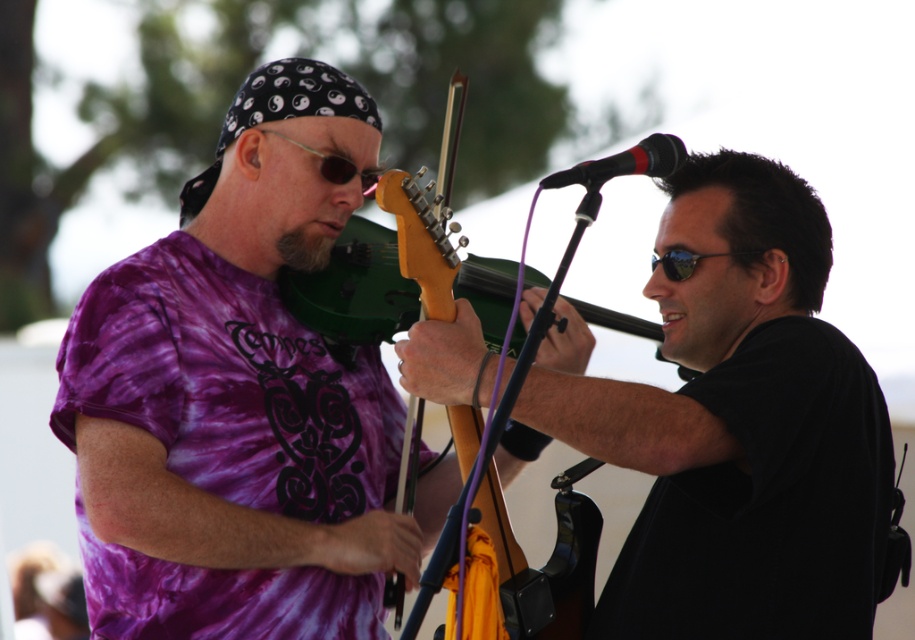
Question: Can you confirm if matte black guitar at center is positioned below green matte violin at center?

Choices:
 (A) no
 (B) yes

Answer: (B)

Question: Considering the relative positions of purple tie-dye shirt at center and matte black guitar at center in the image provided, where is purple tie-dye shirt at center located with respect to matte black guitar at center?

Choices:
 (A) left
 (B) right

Answer: (A)

Question: Which of the following is the closest to the observer?

Choices:
 (A) matte black guitar at center
 (B) green matte violin at center

Answer: (B)

Question: Can you confirm if purple tie-dye shirt at center is positioned to the right of green matte violin at center?

Choices:
 (A) no
 (B) yes

Answer: (A)

Question: Which point appears farthest from the camera in this image?

Choices:
 (A) (325, 435)
 (B) (663, 291)

Answer: (A)

Question: Considering the real-world distances, which object is farthest from the matte black guitar at center?

Choices:
 (A) green matte violin at center
 (B) purple tie-dye shirt at center

Answer: (B)